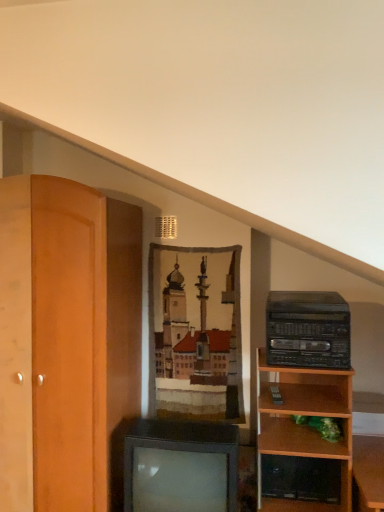
Question: Looking at the image, does metallic gray television at center seem bigger or smaller compared to black plastic stereo at right?

Choices:
 (A) small
 (B) big

Answer: (B)

Question: Considering the positions of metallic gray television at center and black plastic stereo at right in the image, is metallic gray television at center wider or thinner than black plastic stereo at right?

Choices:
 (A) wide
 (B) thin

Answer: (A)

Question: From a real-world perspective, is metallic gray television at center above or below black plastic stereo at right?

Choices:
 (A) above
 (B) below

Answer: (B)

Question: In the image, is black plastic stereo at right positioned in front of or behind metallic gray television at center?

Choices:
 (A) behind
 (B) front

Answer: (A)

Question: Considering the positions of point (322, 339) and point (233, 434), is point (322, 339) closer or farther from the camera than point (233, 434)?

Choices:
 (A) farther
 (B) closer

Answer: (B)

Question: Looking at the image, does black plastic stereo at right seem bigger or smaller compared to metallic gray television at center?

Choices:
 (A) small
 (B) big

Answer: (A)

Question: Is black plastic stereo at right wider or thinner than metallic gray television at center?

Choices:
 (A) wide
 (B) thin

Answer: (B)